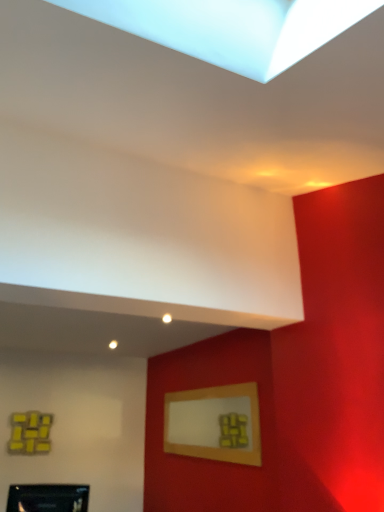
Question: Would you consider wooden picture frame at upper center, arranged as the second picture frame when viewed from the front, to be distant from matte black picture frame at lower left, which is the first picture frame from left to right?

Choices:
 (A) yes
 (B) no

Answer: (A)

Question: From a real-world perspective, is wooden picture frame at upper center, the second picture frame positioned from the left, below matte black picture frame at lower left, which appears as the 1th picture frame when viewed from the front?

Choices:
 (A) no
 (B) yes

Answer: (A)

Question: Is wooden picture frame at upper center, the second picture frame positioned from the left, aimed at matte black picture frame at lower left, acting as the second picture frame starting from the back?

Choices:
 (A) no
 (B) yes

Answer: (B)

Question: Considering the relative sizes of wooden picture frame at upper center, the 1th picture frame positioned from the back, and matte black picture frame at lower left, acting as the second picture frame starting from the back, in the image provided, is wooden picture frame at upper center, the 1th picture frame positioned from the back, bigger than matte black picture frame at lower left, acting as the second picture frame starting from the back,?

Choices:
 (A) yes
 (B) no

Answer: (A)

Question: Is wooden picture frame at upper center, the 1th picture frame positioned from the back, thinner than matte black picture frame at lower left, placed as the second picture frame when sorted from right to left?

Choices:
 (A) no
 (B) yes

Answer: (B)

Question: Is matte black picture frame at lower left, which is the first picture frame from left to right, surrounded by wooden picture frame at upper center, arranged as the second picture frame when viewed from the front?

Choices:
 (A) no
 (B) yes

Answer: (A)

Question: Does matte black picture frame at lower left, acting as the second picture frame starting from the back, have a greater width compared to wooden picture frame at upper center, the 1th picture frame positioned from the back?

Choices:
 (A) no
 (B) yes

Answer: (B)

Question: Does matte black picture frame at lower left, acting as the second picture frame starting from the back, have a lesser width compared to wooden picture frame at upper center, the 1th picture frame from the right?

Choices:
 (A) yes
 (B) no

Answer: (B)

Question: Considering the relative sizes of matte black picture frame at lower left, which appears as the 1th picture frame when viewed from the front, and wooden picture frame at upper center, the 1th picture frame positioned from the back, in the image provided, is matte black picture frame at lower left, which appears as the 1th picture frame when viewed from the front, taller than wooden picture frame at upper center, the 1th picture frame positioned from the back,?

Choices:
 (A) yes
 (B) no

Answer: (B)

Question: Does matte black picture frame at lower left, acting as the second picture frame starting from the back, lie in front of wooden picture frame at upper center, the second picture frame positioned from the left?

Choices:
 (A) no
 (B) yes

Answer: (B)

Question: From a real-world perspective, is matte black picture frame at lower left, placed as the second picture frame when sorted from right to left, located beneath wooden picture frame at upper center, the 1th picture frame positioned from the back?

Choices:
 (A) no
 (B) yes

Answer: (B)

Question: Are matte black picture frame at lower left, which appears as the 1th picture frame when viewed from the front, and wooden picture frame at upper center, the 1th picture frame positioned from the back, making contact?

Choices:
 (A) no
 (B) yes

Answer: (A)

Question: In the image, is matte black picture frame at lower left, acting as the second picture frame starting from the back, positioned in front of or behind wooden picture frame at upper center, the second picture frame positioned from the left?

Choices:
 (A) behind
 (B) front

Answer: (B)